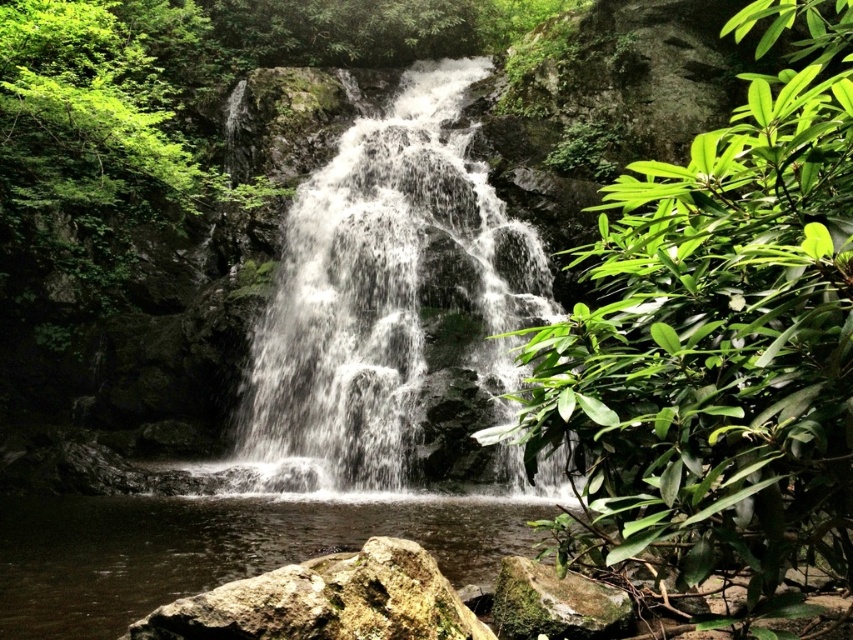
Can you confirm if green glossy leaves at center is wider than clear water at center?

In fact, green glossy leaves at center might be narrower than clear water at center.

From the picture: Is green glossy leaves at center smaller than clear water at center?

No.

What do you see at coordinates (718, 344) in the screenshot? Image resolution: width=853 pixels, height=640 pixels. I see `green glossy leaves at center` at bounding box center [718, 344].

The image size is (853, 640). Identify the location of green glossy leaves at center. 718,344.

Can you confirm if white frothy water at center is positioned above brown rough rock at lower center?

Indeed, white frothy water at center is positioned over brown rough rock at lower center.

Describe the element at coordinates (383, 294) in the screenshot. I see `white frothy water at center` at that location.

Find the location of a particular element. The width and height of the screenshot is (853, 640). white frothy water at center is located at coordinates (383, 294).

The height and width of the screenshot is (640, 853). In order to click on clear water at center in this screenshot , I will do `click(218, 547)`.

Between clear water at center and brown rough rock at lower center, which one appears on the right side from the viewer's perspective?

brown rough rock at lower center is more to the right.

Which is behind, point (152, 596) or point (399, 620)?

Positioned behind is point (152, 596).

Identify the location of clear water at center. tap(218, 547).